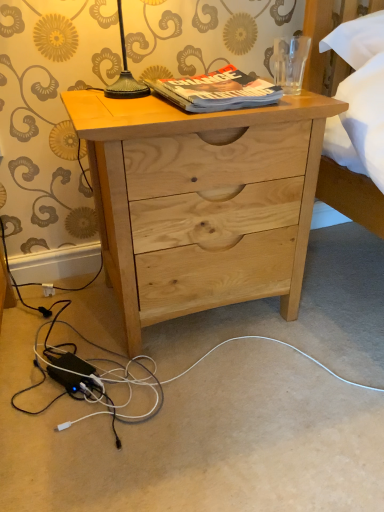
Question: Can you confirm if natural wood nightstand at center is positioned to the right of hardcover book at upper center?

Choices:
 (A) yes
 (B) no

Answer: (B)

Question: Could you tell me if natural wood nightstand at center is turned towards hardcover book at upper center?

Choices:
 (A) yes
 (B) no

Answer: (B)

Question: From a real-world perspective, does natural wood nightstand at center sit lower than hardcover book at upper center?

Choices:
 (A) no
 (B) yes

Answer: (B)

Question: Can you confirm if natural wood nightstand at center is taller than hardcover book at upper center?

Choices:
 (A) yes
 (B) no

Answer: (A)

Question: Considering the relative positions of natural wood nightstand at center and hardcover book at upper center in the image provided, is natural wood nightstand at center behind hardcover book at upper center?

Choices:
 (A) no
 (B) yes

Answer: (A)

Question: Is hardcover book at upper center at the back of natural wood nightstand at center?

Choices:
 (A) no
 (B) yes

Answer: (A)

Question: Can you confirm if hardcover book at upper center is wider than natural wood nightstand at center?

Choices:
 (A) no
 (B) yes

Answer: (A)

Question: Is hardcover book at upper center in contact with natural wood nightstand at center?

Choices:
 (A) no
 (B) yes

Answer: (A)

Question: Considering the relative sizes of hardcover book at upper center and natural wood nightstand at center in the image provided, is hardcover book at upper center thinner than natural wood nightstand at center?

Choices:
 (A) yes
 (B) no

Answer: (A)

Question: Does hardcover book at upper center have a larger size compared to natural wood nightstand at center?

Choices:
 (A) no
 (B) yes

Answer: (A)

Question: Would you say hardcover book at upper center is a long distance from natural wood nightstand at center?

Choices:
 (A) no
 (B) yes

Answer: (A)

Question: Does hardcover book at upper center have a greater height compared to natural wood nightstand at center?

Choices:
 (A) yes
 (B) no

Answer: (B)

Question: In terms of height, does natural wood nightstand at center look taller or shorter compared to hardcover book at upper center?

Choices:
 (A) tall
 (B) short

Answer: (A)